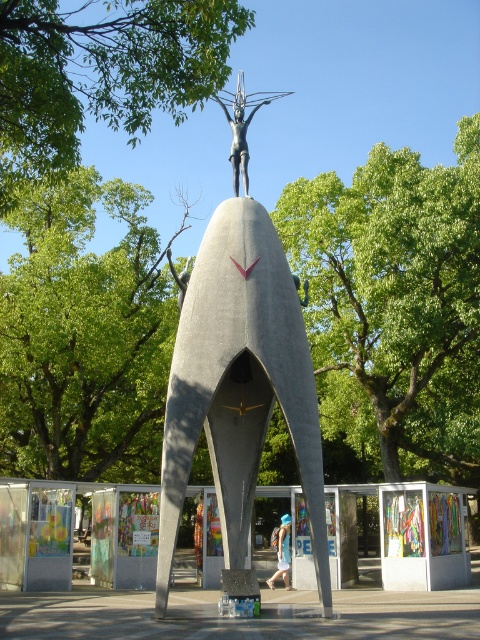
Question: Is polished bronze statue at center below blue denim shorts at center?

Choices:
 (A) yes
 (B) no

Answer: (B)

Question: Can you confirm if green leafy tree at upper center is positioned above blue denim shorts at center?

Choices:
 (A) yes
 (B) no

Answer: (A)

Question: Does gray polished concrete statue at center appear over blue denim shorts at center?

Choices:
 (A) no
 (B) yes

Answer: (B)

Question: Which point is farther to the camera?

Choices:
 (A) (247, 160)
 (B) (218, 32)

Answer: (A)

Question: Which object is closer to the camera taking this photo?

Choices:
 (A) polished bronze statue at center
 (B) green leafy tree at upper center
 (C) blue denim shorts at center
 (D) gray polished concrete statue at center

Answer: (B)

Question: Which point is farther to the camera?

Choices:
 (A) gray polished concrete statue at center
 (B) blue denim shorts at center
 (C) polished bronze statue at center

Answer: (B)